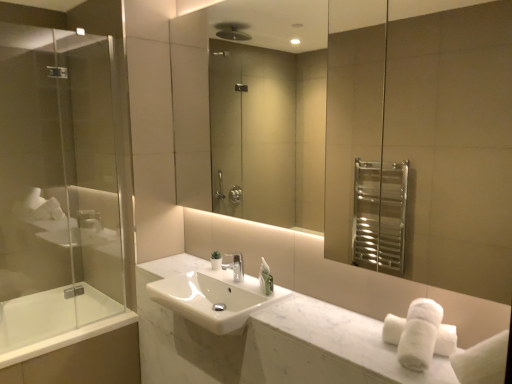
Question: Considering the relative positions of white marble counter at center and transparent glass screen door at left in the image provided, is white marble counter at center to the right of transparent glass screen door at left from the viewer's perspective?

Choices:
 (A) yes
 (B) no

Answer: (A)

Question: Is white marble counter at center wider than transparent glass screen door at left?

Choices:
 (A) yes
 (B) no

Answer: (A)

Question: Is transparent glass screen door at left located within white marble counter at center?

Choices:
 (A) yes
 (B) no

Answer: (B)

Question: Can you confirm if white marble counter at center is bigger than transparent glass screen door at left?

Choices:
 (A) yes
 (B) no

Answer: (B)

Question: Can you confirm if white marble counter at center is smaller than transparent glass screen door at left?

Choices:
 (A) yes
 (B) no

Answer: (A)

Question: Which is correct: transparent glass screen door at left is inside white marble counter at center, or outside of it?

Choices:
 (A) outside
 (B) inside

Answer: (A)

Question: In terms of width, does transparent glass screen door at left look wider or thinner when compared to white marble counter at center?

Choices:
 (A) thin
 (B) wide

Answer: (A)

Question: Would you say transparent glass screen door at left is to the left or to the right of white marble counter at center in the picture?

Choices:
 (A) right
 (B) left

Answer: (B)

Question: From the image's perspective, is transparent glass screen door at left located above or below white marble counter at center?

Choices:
 (A) below
 (B) above

Answer: (B)

Question: Is point (168, 344) closer or farther from the camera than point (12, 39)?

Choices:
 (A) closer
 (B) farther

Answer: (A)

Question: In terms of height, does white marble counter at center look taller or shorter compared to transparent glass screen door at left?

Choices:
 (A) tall
 (B) short

Answer: (B)

Question: Visually, is white marble counter at center positioned to the left or to the right of transparent glass screen door at left?

Choices:
 (A) right
 (B) left

Answer: (A)

Question: Looking at their shapes, would you say white marble counter at center is wider or thinner than transparent glass screen door at left?

Choices:
 (A) thin
 (B) wide

Answer: (B)

Question: Visually, is white marble counter at center positioned to the left or to the right of silver metallic faucet at center?

Choices:
 (A) left
 (B) right

Answer: (B)

Question: Is white marble counter at center bigger or smaller than silver metallic faucet at center?

Choices:
 (A) small
 (B) big

Answer: (B)